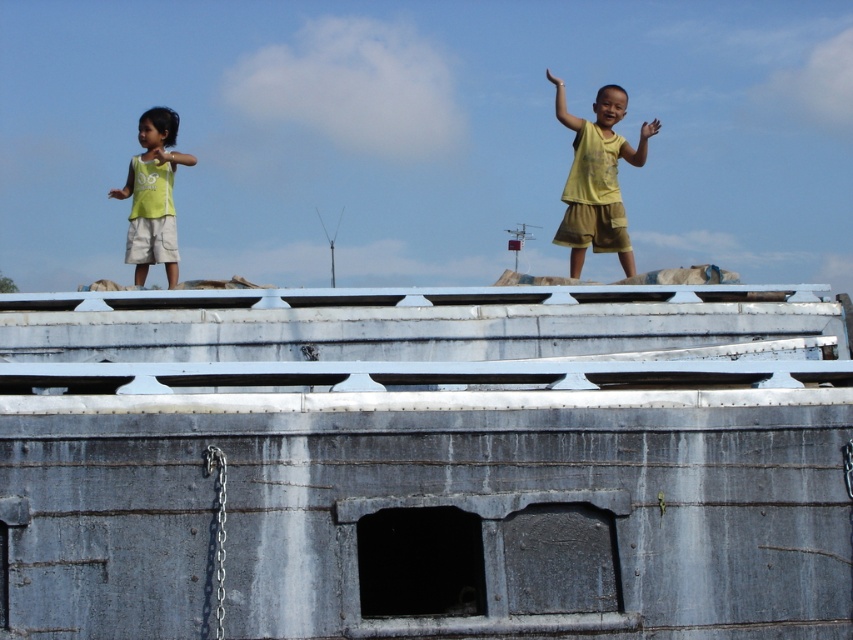
Between yellow matte shirt at upper right and green matte shorts at left, which one has more height?

yellow matte shirt at upper right is taller.

Is yellow matte shirt at upper right thinner than green matte shorts at left?

Yes.

Between point (581, 173) and point (141, 246), which one is positioned behind?

The point (581, 173) is more distant.

You are a GUI agent. You are given a task and a screenshot of the screen. Output one action in this format:
    pyautogui.click(x=<x>, y=<y>)
    Task: Click on the yellow matte shirt at upper right
    
    Given the screenshot: What is the action you would take?
    598,172